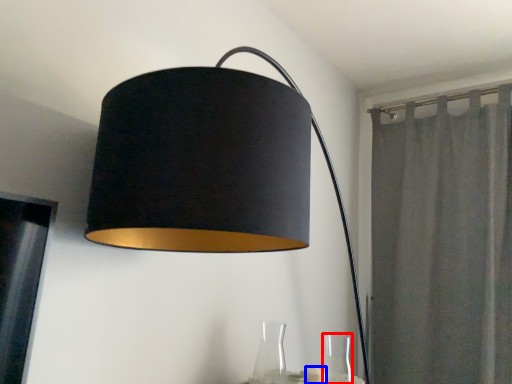
Question: Which of the following is the farthest to the observer, glass vase (highlighted by a red box) or candle (highlighted by a blue box)?

Choices:
 (A) glass vase
 (B) candle

Answer: (B)